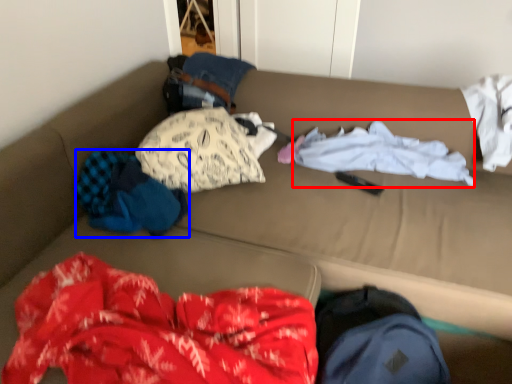
Question: Which object appears farthest to the camera in this image, clothing (highlighted by a red box) or clothing (highlighted by a blue box)?

Choices:
 (A) clothing
 (B) clothing

Answer: (A)